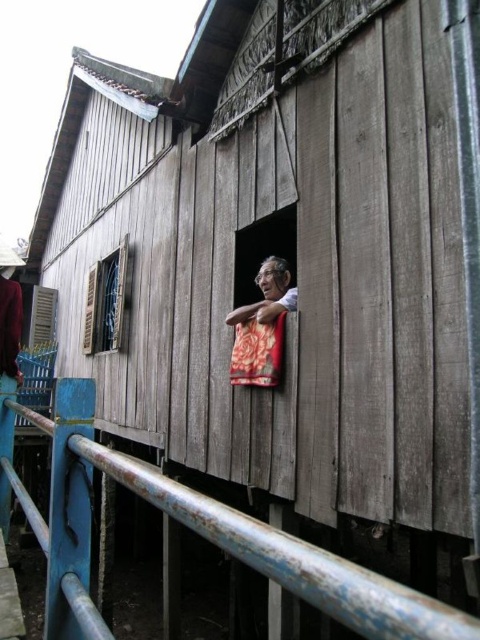
Question: Which point is closer to the camera?

Choices:
 (A) wooden shutter at left
 (B) floral fabric at window
 (C) rusty metal railing at lower left

Answer: (C)

Question: Is rusty metal railing at lower left to the right of floral fabric at window from the viewer's perspective?

Choices:
 (A) no
 (B) yes

Answer: (A)

Question: Does rusty metal railing at lower left lie in front of wooden shutter at left?

Choices:
 (A) yes
 (B) no

Answer: (A)

Question: Estimate the real-world distances between objects in this image. Which object is farther from the floral fabric at window?

Choices:
 (A) wooden shutter at left
 (B) rusty metal railing at lower left

Answer: (A)

Question: Observing the image, what is the correct spatial positioning of rusty metal railing at lower left in reference to wooden shutter at left?

Choices:
 (A) below
 (B) above

Answer: (A)

Question: Based on their relative distances, which object is farther from the wooden shutter at left?

Choices:
 (A) rusty metal railing at lower left
 (B) floral fabric at window

Answer: (A)